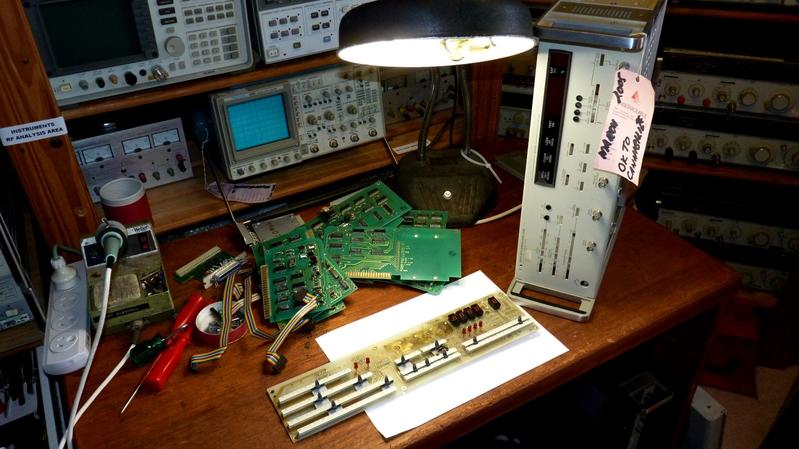
Locate an element on the screen. This screenshot has height=449, width=799. table is located at coordinates point(217,398).